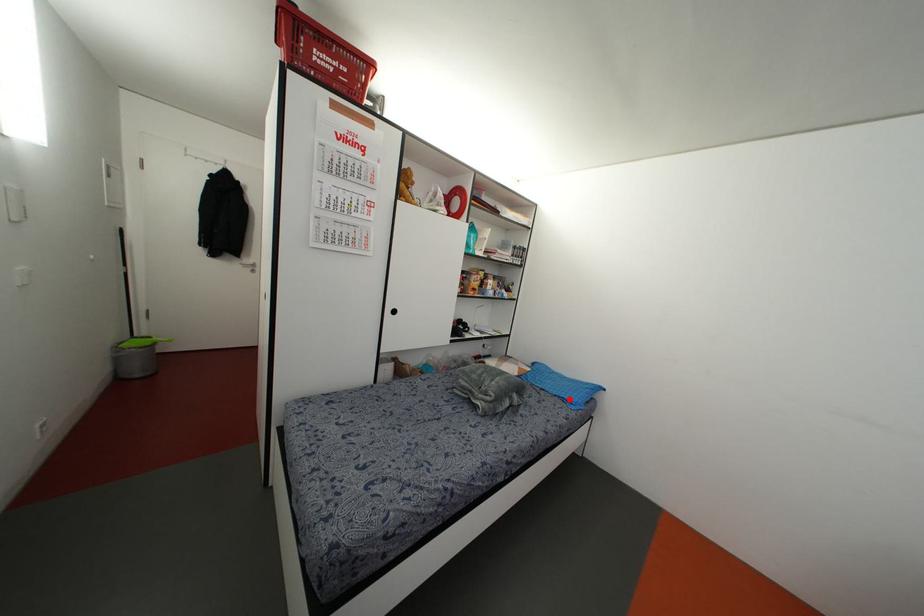
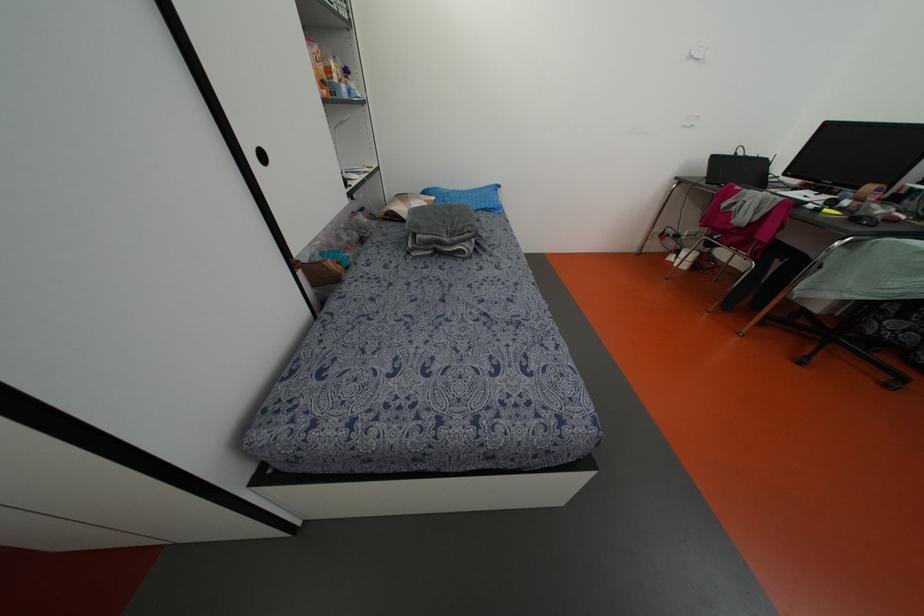
Find the pixel in the second image that matches the highlighted location in the first image.

(492, 206)